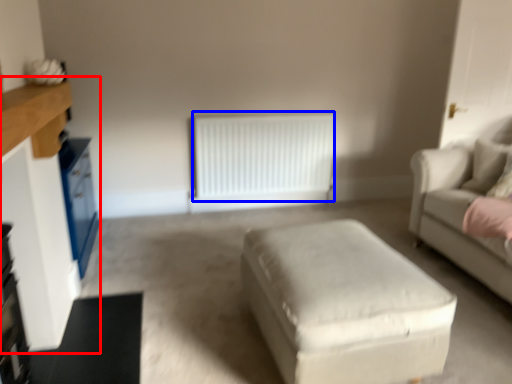
Question: Which object appears farthest to the camera in this image, entertainment center (highlighted by a red box) or radiator (highlighted by a blue box)?

Choices:
 (A) entertainment center
 (B) radiator

Answer: (B)